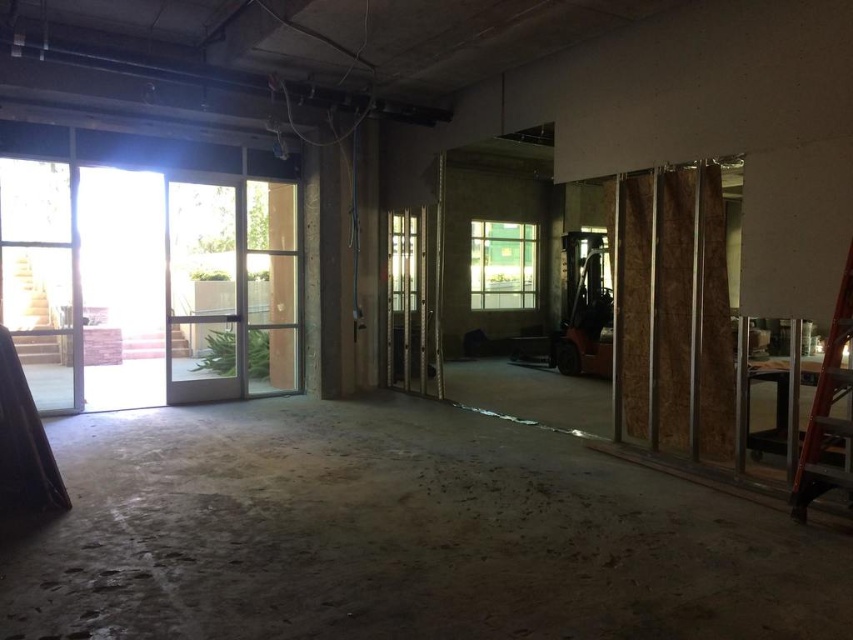
Question: Among these points, which one is farthest from the camera?

Choices:
 (A) click(x=849, y=499)
 (B) click(x=415, y=230)
 (C) click(x=503, y=227)

Answer: (C)

Question: Which point is farther from the camera taking this photo?

Choices:
 (A) (471, 237)
 (B) (387, 384)
 (C) (821, 371)

Answer: (A)

Question: Can you confirm if red wood ladder at right is smaller than green glass window at center?

Choices:
 (A) no
 (B) yes

Answer: (B)

Question: Among these points, which one is nearest to the camera?

Choices:
 (A) (503, 237)
 (B) (813, 397)

Answer: (B)

Question: Is clear glass door at center closer to the viewer compared to green glass window at center?

Choices:
 (A) yes
 (B) no

Answer: (A)

Question: Does clear glass door at center appear on the right side of green glass window at center?

Choices:
 (A) yes
 (B) no

Answer: (B)